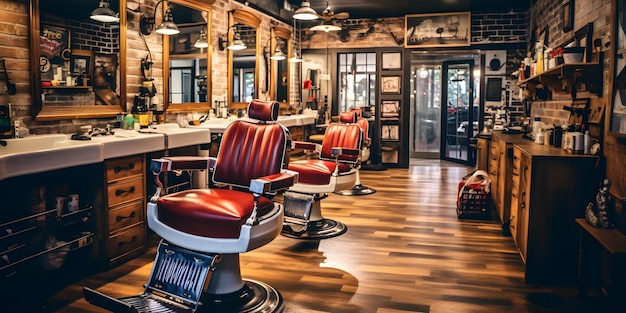
What are the coordinates of `crate` in the screenshot? It's located at (474, 211).